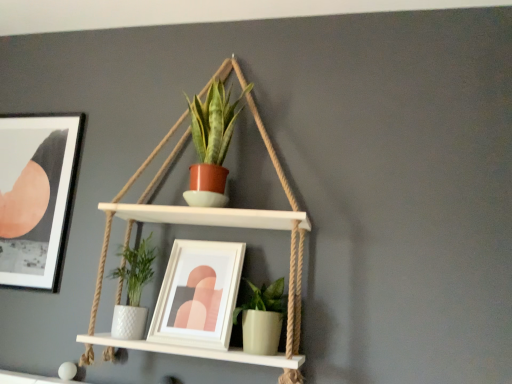
Question: From the image's perspective, is matte terracotta pot at center, placed as the 2th houseplant when sorted from bottom to top, located above green matte pot at lower center, the second houseplant viewed from the top?

Choices:
 (A) no
 (B) yes

Answer: (B)

Question: From a real-world perspective, is matte terracotta pot at center, placed as the 2th houseplant when sorted from bottom to top, physically below green matte pot at lower center, the second houseplant viewed from the top?

Choices:
 (A) yes
 (B) no

Answer: (B)

Question: From a real-world perspective, is matte terracotta pot at center, placed as the 2th houseplant when sorted from bottom to top, physically above green matte pot at lower center, which ranks as the 1th houseplant in bottom-to-top order?

Choices:
 (A) no
 (B) yes

Answer: (B)

Question: Are matte terracotta pot at center, placed as the 2th houseplant when sorted from bottom to top, and green matte pot at lower center, the second houseplant viewed from the top, located far from each other?

Choices:
 (A) no
 (B) yes

Answer: (A)

Question: Does matte terracotta pot at center, the 1th houseplant in the top-to-bottom sequence, have a lesser width compared to green matte pot at lower center, which ranks as the 1th houseplant in bottom-to-top order?

Choices:
 (A) yes
 (B) no

Answer: (B)

Question: Choose the correct answer: Is white matte picture frame at center, the second picture frame from the left, inside matte black picture frame at upper left, which ranks as the 1th picture frame in left-to-right order, or outside it?

Choices:
 (A) inside
 (B) outside

Answer: (B)

Question: Based on their positions, is white matte picture frame at center, which is counted as the 1th picture frame, starting from the front, located to the left or right of matte black picture frame at upper left, acting as the 1th picture frame starting from the back?

Choices:
 (A) right
 (B) left

Answer: (A)

Question: Is white matte picture frame at center, marked as the second picture frame in a back-to-front arrangement, in front of or behind matte black picture frame at upper left, which is the 2th picture frame in right-to-left order, in the image?

Choices:
 (A) front
 (B) behind

Answer: (A)

Question: From the image's perspective, is white matte picture frame at center, which is counted as the 1th picture frame, starting from the front, located above or below matte black picture frame at upper left, which is the 2th picture frame in right-to-left order?

Choices:
 (A) above
 (B) below

Answer: (B)

Question: From the image's perspective, is matte black picture frame at upper left, which is the 2th picture frame in right-to-left order, above or below matte terracotta pot at center, placed as the 2th houseplant when sorted from bottom to top?

Choices:
 (A) below
 (B) above

Answer: (A)

Question: Do you think matte black picture frame at upper left, which ranks as the 1th picture frame in left-to-right order, is within matte terracotta pot at center, the 1th houseplant in the top-to-bottom sequence, or outside of it?

Choices:
 (A) outside
 (B) inside

Answer: (A)

Question: Is matte black picture frame at upper left, placed as the second picture frame when sorted from front to back, bigger or smaller than matte terracotta pot at center, the 1th houseplant in the top-to-bottom sequence?

Choices:
 (A) small
 (B) big

Answer: (A)

Question: Considering the positions of matte black picture frame at upper left, acting as the 1th picture frame starting from the back, and matte terracotta pot at center, the 1th houseplant in the top-to-bottom sequence, in the image, is matte black picture frame at upper left, acting as the 1th picture frame starting from the back, taller or shorter than matte terracotta pot at center, the 1th houseplant in the top-to-bottom sequence,?

Choices:
 (A) short
 (B) tall

Answer: (B)

Question: Would you say matte terracotta pot at center, the 1th houseplant in the top-to-bottom sequence, is to the left or to the right of green matte pot at lower center, which ranks as the 1th houseplant in bottom-to-top order, in the picture?

Choices:
 (A) left
 (B) right

Answer: (A)

Question: Considering their positions, is matte terracotta pot at center, the 1th houseplant in the top-to-bottom sequence, located in front of or behind green matte pot at lower center, the second houseplant viewed from the top?

Choices:
 (A) behind
 (B) front

Answer: (A)